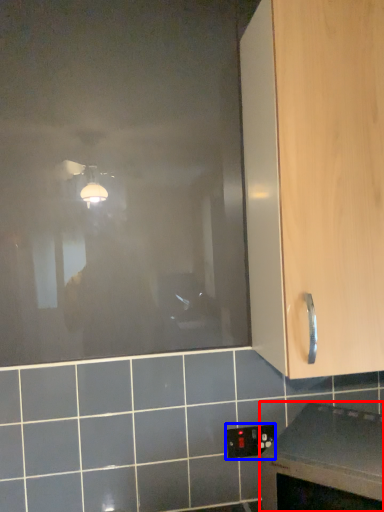
Question: Among these objects, which one is farthest to the camera, countertop (highlighted by a red box) or electric outlet (highlighted by a blue box)?

Choices:
 (A) countertop
 (B) electric outlet

Answer: (B)